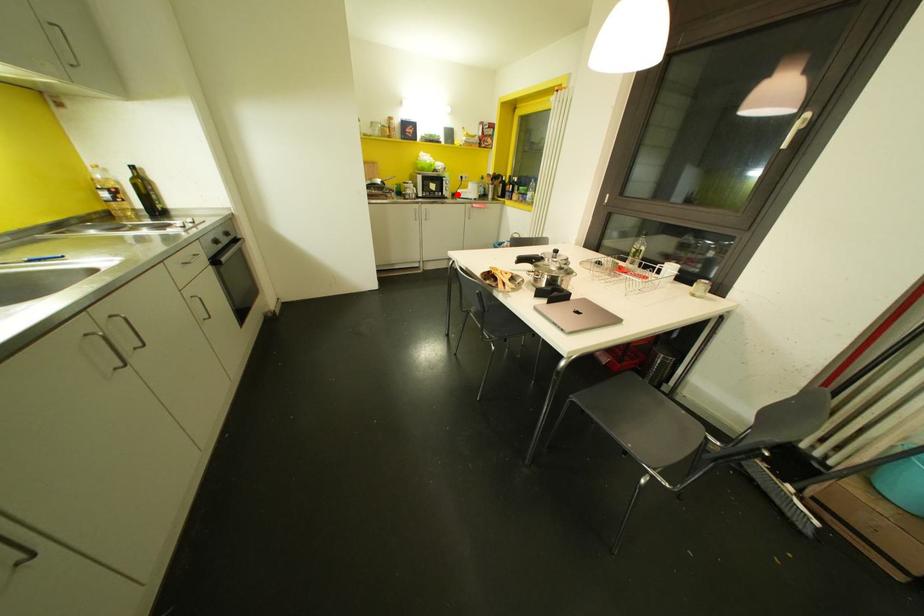
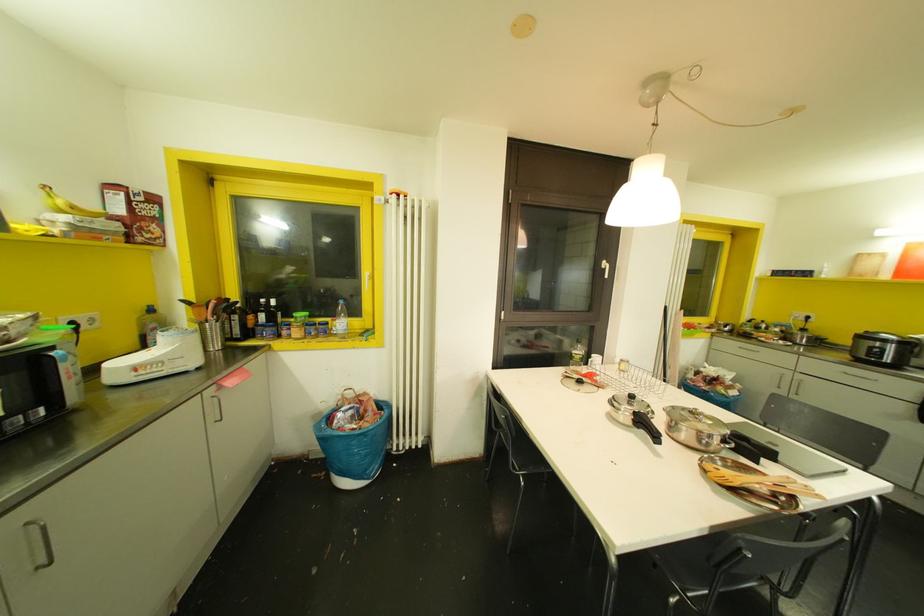
Locate, in the second image, the point that corresponds to the highlighted location in the first image.

(116, 378)